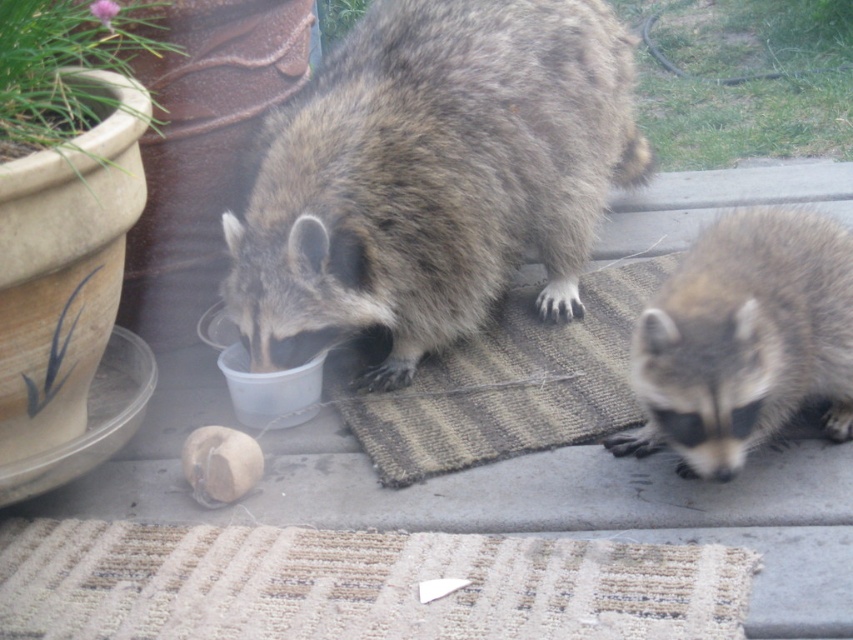
You are a photographer trying to capture both raccoons in a single shot. Since your camera can only focus on objects within a 3 meter width, can you fit both fuzzy brown raccoon at center and fuzzy brown raccoon at lower right into the frame?

The fuzzy brown raccoon at center is to the left of the fuzzy brown raccoon at lower right, but the distance between them isn

You are a wildlife photographer trying to capture both raccoons in a single frame. Given that the fuzzy brown raccoon at center is closer to the camera than the fuzzy brown raccoon at lower right, which raccoon should you focus on to ensure both are in focus?

You should focus on the fuzzy brown raccoon at center because it is closer to the camera, and adjusting the focus there will help ensure the fuzzy brown raccoon at lower right, which is further away, is also in focus due to the depth of field.

You are standing at the point closest to the camera between the two points, point (x=450, y=268) and point (x=724, y=468). You want to walk towards the point that is further away from you. Which point should you head towards?

You should head towards point (x=450, y=268) because it is behind point (x=724, y=468), meaning it is further away from your current position.